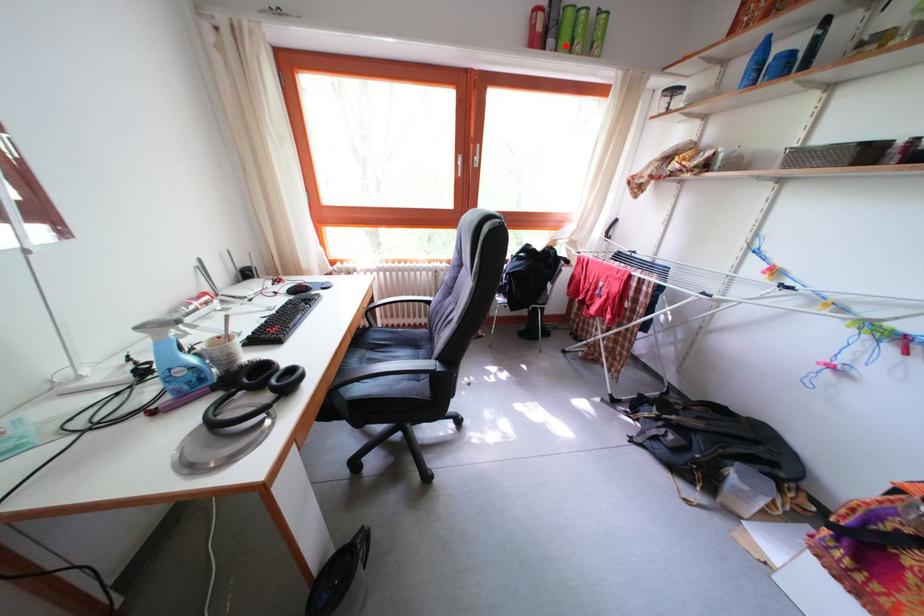
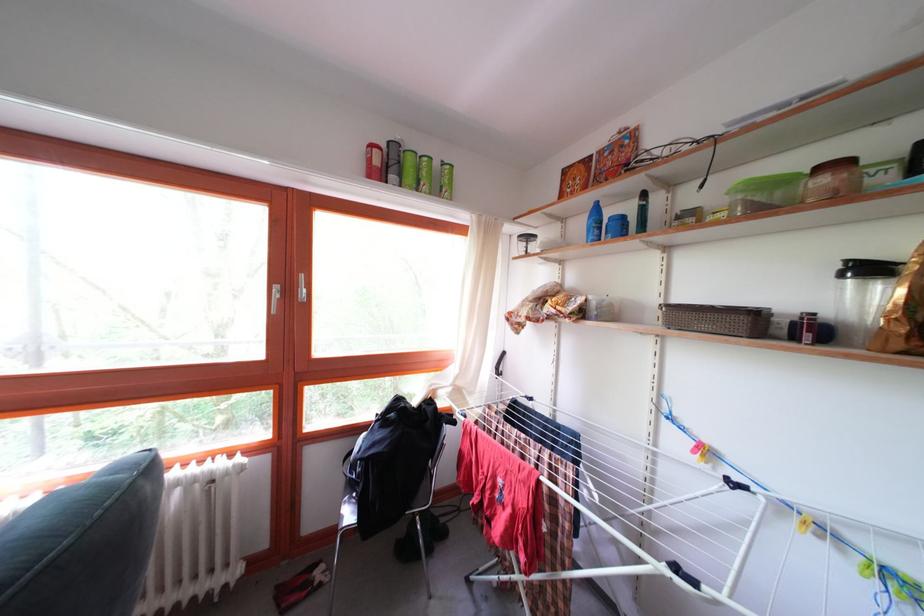
Locate, in the second image, the point that corresponds to the highlighted location in the first image.

(409, 180)